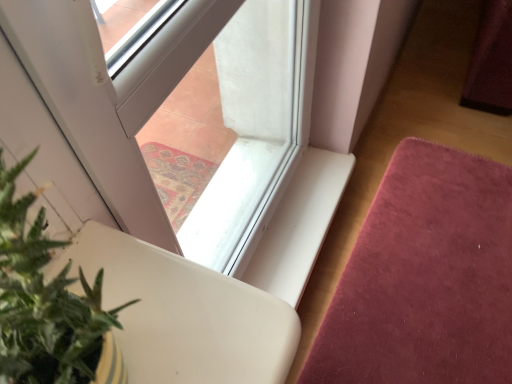
Question: From a real-world perspective, is green leafy plant at lower left on top of transparent glass window at center?

Choices:
 (A) no
 (B) yes

Answer: (B)

Question: Is green leafy plant at lower left further to camera compared to transparent glass window at center?

Choices:
 (A) no
 (B) yes

Answer: (A)

Question: Does green leafy plant at lower left have a greater width compared to transparent glass window at center?

Choices:
 (A) yes
 (B) no

Answer: (A)

Question: From the image's perspective, is green leafy plant at lower left located above transparent glass window at center?

Choices:
 (A) yes
 (B) no

Answer: (B)

Question: Can you confirm if green leafy plant at lower left is shorter than transparent glass window at center?

Choices:
 (A) no
 (B) yes

Answer: (B)

Question: Considering the positions of point (494, 301) and point (162, 210), is point (494, 301) closer or farther from the camera than point (162, 210)?

Choices:
 (A) closer
 (B) farther

Answer: (B)

Question: Looking at the image, does velvet pink mat at lower right seem bigger or smaller compared to transparent glass window at center?

Choices:
 (A) big
 (B) small

Answer: (A)

Question: In terms of width, does velvet pink mat at lower right look wider or thinner when compared to transparent glass window at center?

Choices:
 (A) wide
 (B) thin

Answer: (A)

Question: From the image's perspective, relative to transparent glass window at center, is velvet pink mat at lower right above or below?

Choices:
 (A) above
 (B) below

Answer: (B)

Question: From the image's perspective, is transparent glass window at center located above or below velvet pink mat at lower right?

Choices:
 (A) above
 (B) below

Answer: (A)

Question: Visually, is transparent glass window at center positioned to the left or to the right of velvet pink mat at lower right?

Choices:
 (A) right
 (B) left

Answer: (B)

Question: In terms of width, does transparent glass window at center look wider or thinner when compared to velvet pink mat at lower right?

Choices:
 (A) thin
 (B) wide

Answer: (A)

Question: In the image, is transparent glass window at center positioned in front of or behind velvet pink mat at lower right?

Choices:
 (A) behind
 (B) front

Answer: (B)

Question: Based on their sizes in the image, would you say transparent glass window at center is bigger or smaller than green leafy plant at lower left?

Choices:
 (A) small
 (B) big

Answer: (B)

Question: Is transparent glass window at center spatially inside green leafy plant at lower left, or outside of it?

Choices:
 (A) outside
 (B) inside

Answer: (A)